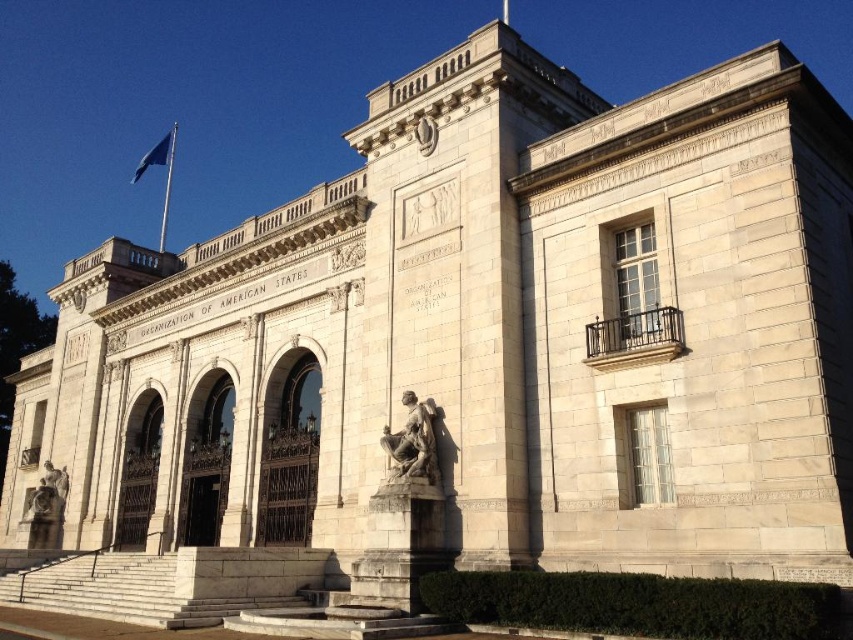
You are standing in front of the grand neoclassical building and want to take a photo that includes both the bronze statue at lower left and the blue fabric flag at upper left. Based on their positions, which object should you place on the right side of your camera frame to ensure both are visible?

The bronze statue at lower left is to the right of the blue fabric flag at upper left, so you should place the bronze statue at lower left on the right side of your camera frame to include both in the photo.

You are standing in front of the grand neoclassical building and notice two points marked on its facade. The first point is at coordinate point (x=61, y=488) and the second is at point (x=141, y=172). Which of these two points is closer to your current position?

Point (x=61, y=488) is closer to the camera than point (x=141, y=172), so the first point is closer to your current position.